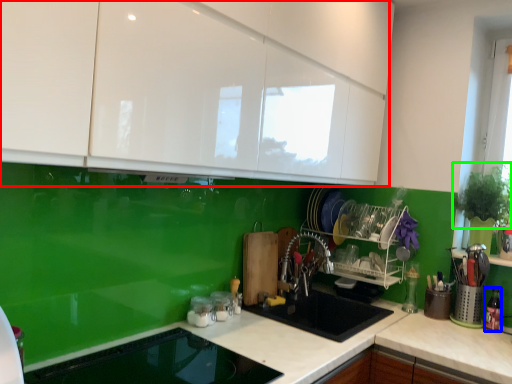
Question: Which object is positioned closest to cabinetry (highlighted by a red box)? Select from appliance (highlighted by a blue box) and plant (highlighted by a green box).

Choices:
 (A) appliance
 (B) plant

Answer: (B)